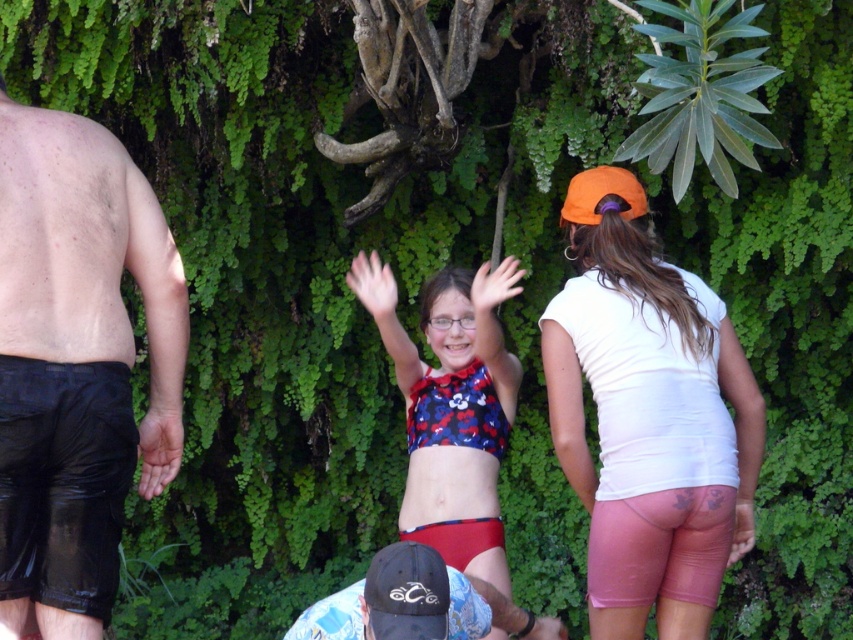
You are a photographer trying to capture a closeup of the blue floral bikini top at center and the black cap at lower center. Since you want to focus on the bikini top, which object should you zoom in on more to ensure it takes up more of the frame?

The blue floral bikini top at center occupies less space than the black cap at lower center, so you should zoom in more on the blue floral bikini top at center to make it take up more of the frame.